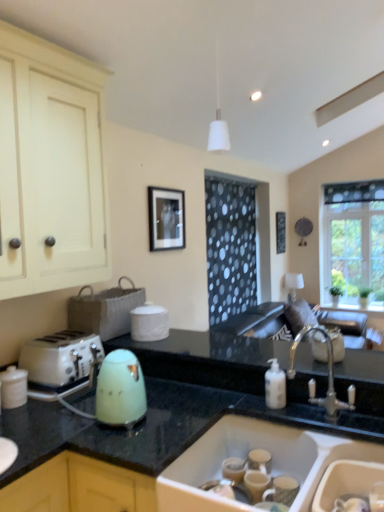
Question: From the image's perspective, does white glossy jar at lower left appear higher than white plastic toaster at left?

Choices:
 (A) no
 (B) yes

Answer: (A)

Question: Is white glossy jar at lower left far away from white plastic toaster at left?

Choices:
 (A) yes
 (B) no

Answer: (B)

Question: From the image's perspective, is white glossy jar at lower left under white plastic toaster at left?

Choices:
 (A) no
 (B) yes

Answer: (B)

Question: Is white glossy jar at lower left beside white plastic toaster at left?

Choices:
 (A) no
 (B) yes

Answer: (A)

Question: Could you tell me if white glossy jar at lower left is turned towards white plastic toaster at left?

Choices:
 (A) yes
 (B) no

Answer: (B)

Question: In the image, is white ceramic sink at lower center on the left side or the right side of matte cream cabinet at left?

Choices:
 (A) left
 (B) right

Answer: (B)

Question: Is point tap(254, 425) closer or farther from the camera than point tap(34, 94)?

Choices:
 (A) farther
 (B) closer

Answer: (A)

Question: Is white ceramic sink at lower center in front of or behind matte cream cabinet at left in the image?

Choices:
 (A) front
 (B) behind

Answer: (A)

Question: Which is correct: white ceramic sink at lower center is inside matte cream cabinet at left, or outside of it?

Choices:
 (A) outside
 (B) inside

Answer: (A)

Question: In terms of height, does matte cream cabinet at left look taller or shorter compared to white plastic toaster at left?

Choices:
 (A) tall
 (B) short

Answer: (A)

Question: In the image, is matte cream cabinet at left on the left side or the right side of white plastic toaster at left?

Choices:
 (A) right
 (B) left

Answer: (B)

Question: From the image's perspective, is matte cream cabinet at left above or below white plastic toaster at left?

Choices:
 (A) above
 (B) below

Answer: (A)

Question: In terms of size, does matte cream cabinet at left appear bigger or smaller than white plastic toaster at left?

Choices:
 (A) small
 (B) big

Answer: (B)

Question: In the image, is white glossy jar at lower left on the left side or the right side of green glossy kettle at lower center?

Choices:
 (A) right
 (B) left

Answer: (B)

Question: Looking at their shapes, would you say white glossy jar at lower left is wider or thinner than green glossy kettle at lower center?

Choices:
 (A) wide
 (B) thin

Answer: (B)